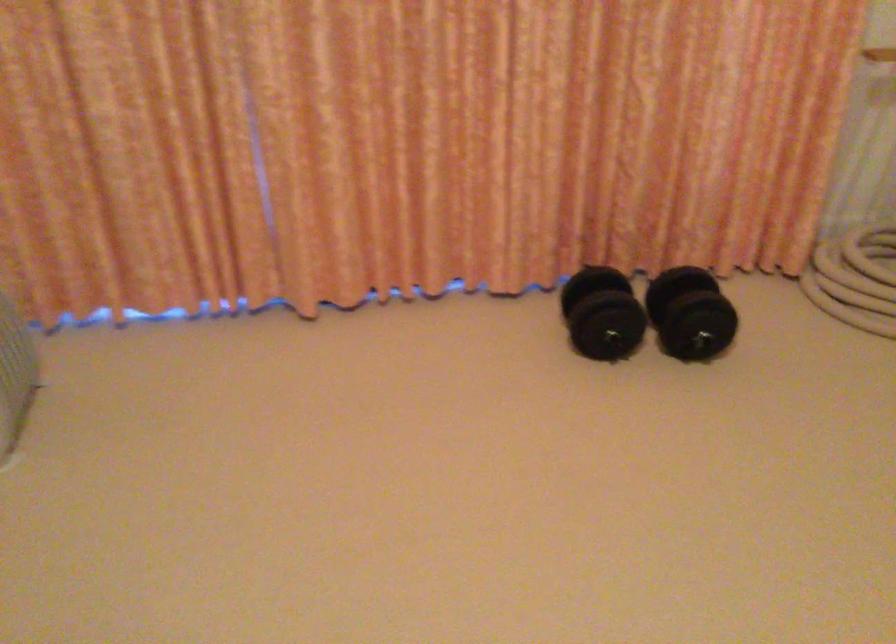
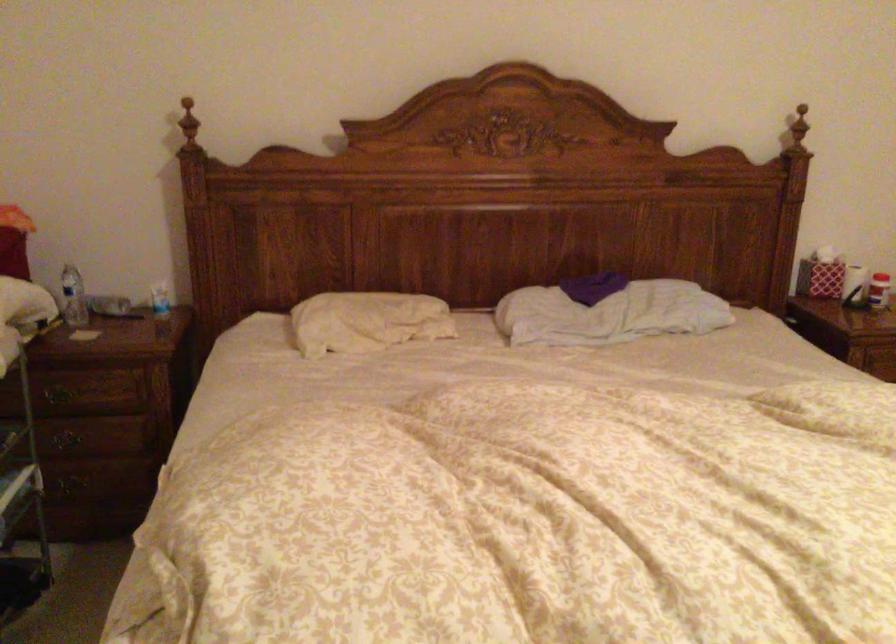
Question: The camera is either moving clockwise (left) or counter-clockwise (right) around the object. The first image is from the beginning of the video and the second image is from the end. Is the camera moving left or right when shooting the video?

Choices:
 (A) Left
 (B) Right

Answer: (B)